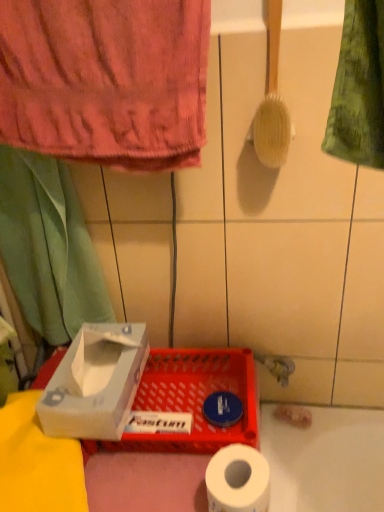
Question: Considering the relative sizes of white cardboard box at lower left and white matte toilet paper at lower center in the image provided, is white cardboard box at lower left taller than white matte toilet paper at lower center?

Choices:
 (A) no
 (B) yes

Answer: (B)

Question: Is the position of white cardboard box at lower left less distant than that of white matte toilet paper at lower center?

Choices:
 (A) no
 (B) yes

Answer: (A)

Question: Can you confirm if white cardboard box at lower left is wider than white matte toilet paper at lower center?

Choices:
 (A) yes
 (B) no

Answer: (A)

Question: Could white matte toilet paper at lower center be considered to be inside white cardboard box at lower left?

Choices:
 (A) no
 (B) yes

Answer: (A)

Question: Is white cardboard box at lower left positioned behind white matte toilet paper at lower center?

Choices:
 (A) no
 (B) yes

Answer: (B)

Question: Is white cardboard box at lower left oriented towards white matte toilet paper at lower center?

Choices:
 (A) yes
 (B) no

Answer: (B)

Question: From the image's perspective, does green fabric curtain at left appear higher than white matte toilet paper at lower center?

Choices:
 (A) yes
 (B) no

Answer: (A)

Question: Does green fabric curtain at left lie in front of white matte toilet paper at lower center?

Choices:
 (A) yes
 (B) no

Answer: (B)

Question: Is green fabric curtain at left facing away from white matte toilet paper at lower center?

Choices:
 (A) yes
 (B) no

Answer: (B)

Question: From a real-world perspective, is green fabric curtain at left beneath white matte toilet paper at lower center?

Choices:
 (A) yes
 (B) no

Answer: (B)

Question: Can you see green fabric curtain at left touching white matte toilet paper at lower center?

Choices:
 (A) no
 (B) yes

Answer: (A)

Question: Could you tell me if green fabric curtain at left is turned towards white matte toilet paper at lower center?

Choices:
 (A) no
 (B) yes

Answer: (A)

Question: From the image's perspective, is matte plastic basket at lower center under pink cotton towel at upper left?

Choices:
 (A) yes
 (B) no

Answer: (A)